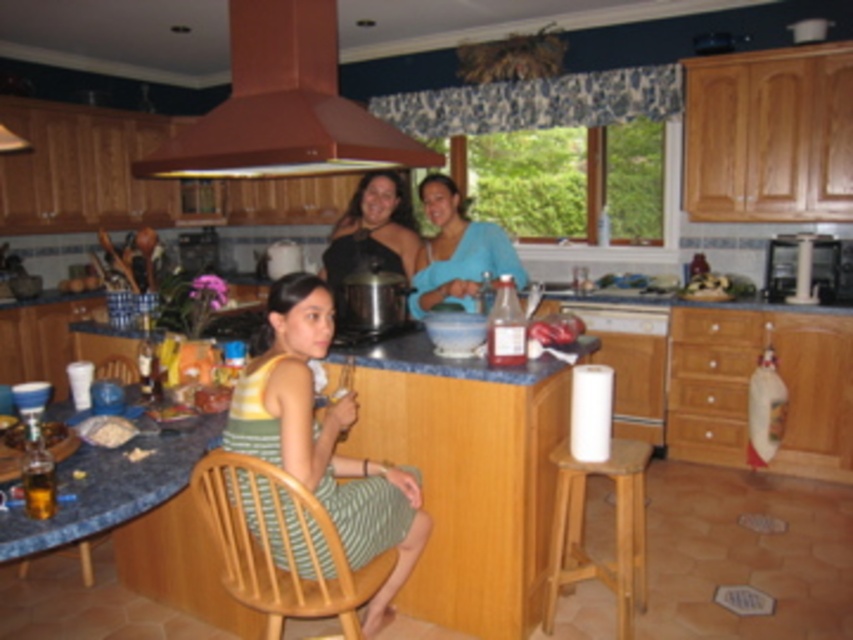
Between point (312, 570) and point (598, 465), which one is positioned in front?

Point (312, 570) is in front.

Between light brown wooden chair at center and wooden stool at lower right, which one has more height?

Standing taller between the two is wooden stool at lower right.

Describe the element at coordinates (279, 545) in the screenshot. I see `light brown wooden chair at center` at that location.

Where is `light brown wooden chair at center`? light brown wooden chair at center is located at coordinates (279, 545).

Is translucent glass jar at lower left taller than wooden chair at lower left?

No, translucent glass jar at lower left is not taller than wooden chair at lower left.

Describe the element at coordinates (51, 433) in the screenshot. I see `translucent glass jar at lower left` at that location.

Between point (51, 422) and point (99, 365), which one is positioned in front?

Point (51, 422) is in front.

This screenshot has height=640, width=853. I want to click on translucent glass jar at lower left, so click(51, 433).

Can you confirm if wooden stool at lower right is taller than translucent glass jar at lower left?

Yes, wooden stool at lower right is taller than translucent glass jar at lower left.

Who is more forward, (556, 461) or (59, 424)?

Point (59, 424)

Image resolution: width=853 pixels, height=640 pixels. In order to click on wooden stool at lower right in this screenshot , I will do `click(614, 529)`.